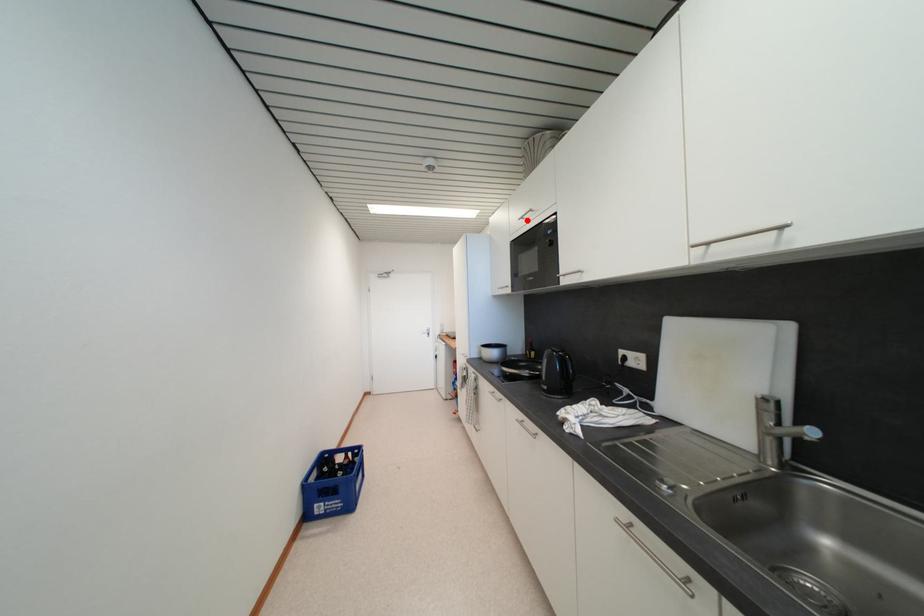
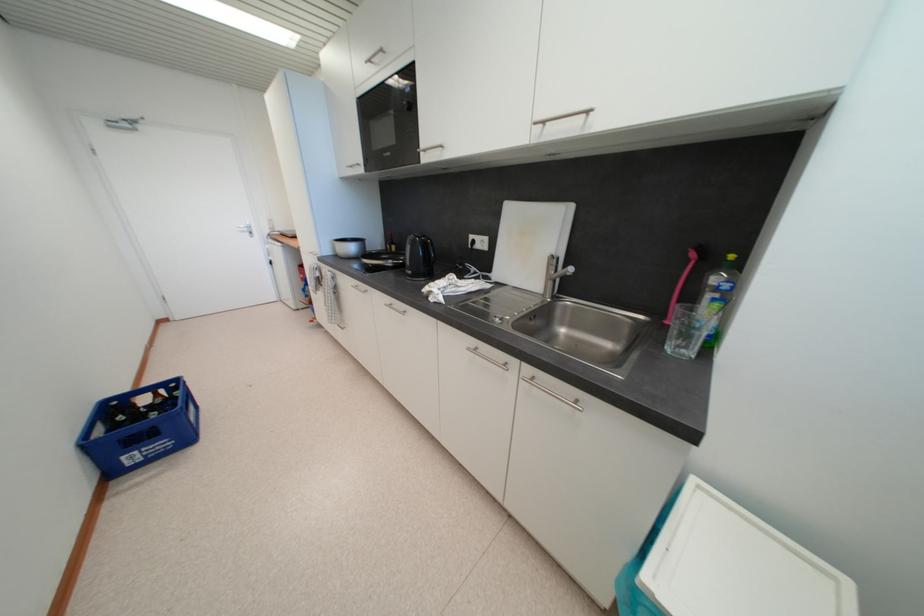
In the second image, find the point that corresponds to the highlighted location in the first image.

(375, 63)